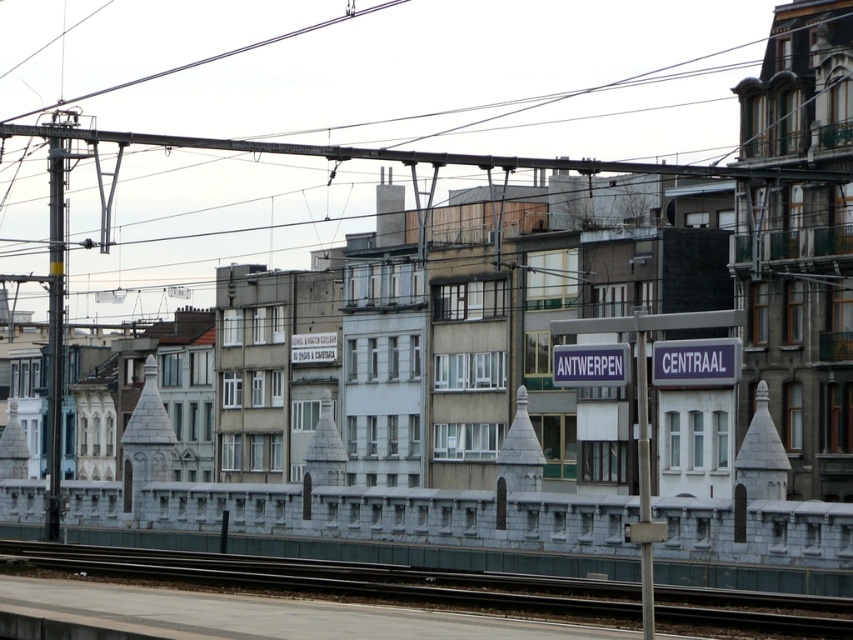
Which of these two, smooth concrete train at center or black metal track at center, stands shorter?

black metal track at center is shorter.

Can you confirm if smooth concrete train at center is shorter than black metal track at center?

No.

Find the location of a particular element. The image size is (853, 640). smooth concrete train at center is located at coordinates (370, 524).

Does smooth concrete train at center have a larger size compared to metallic gray pole at left?

Actually, smooth concrete train at center might be smaller than metallic gray pole at left.

Between point (289, 486) and point (56, 124), which one is positioned in front?

Point (56, 124)

Where is `smooth concrete train at center`? smooth concrete train at center is located at coordinates (370, 524).

Consider the image. Between black metal track at center and metallic gray pole at left, which one is positioned higher?

metallic gray pole at left

Does black metal track at center have a larger size compared to metallic gray pole at left?

No, black metal track at center is not bigger than metallic gray pole at left.

Between point (350, 563) and point (57, 269), which one is positioned behind?

Point (57, 269)

At what (x,y) coordinates should I click in order to perform the action: click on black metal track at center. Please return your answer as a coordinate pair (x, y). Looking at the image, I should click on (341, 579).